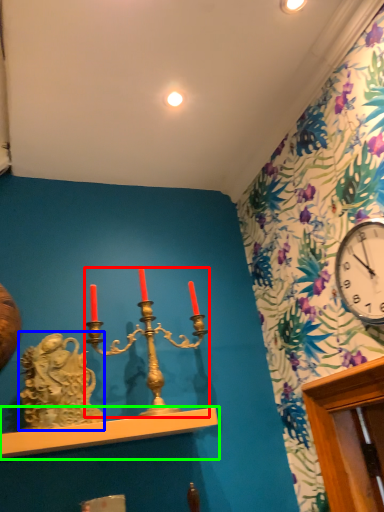
Question: Estimate the real-world distances between objects in this image. Which object is farther from candle holder (highlighted by a red box), sculpture (highlighted by a blue box) or shelf (highlighted by a green box)?

Choices:
 (A) sculpture
 (B) shelf

Answer: (A)